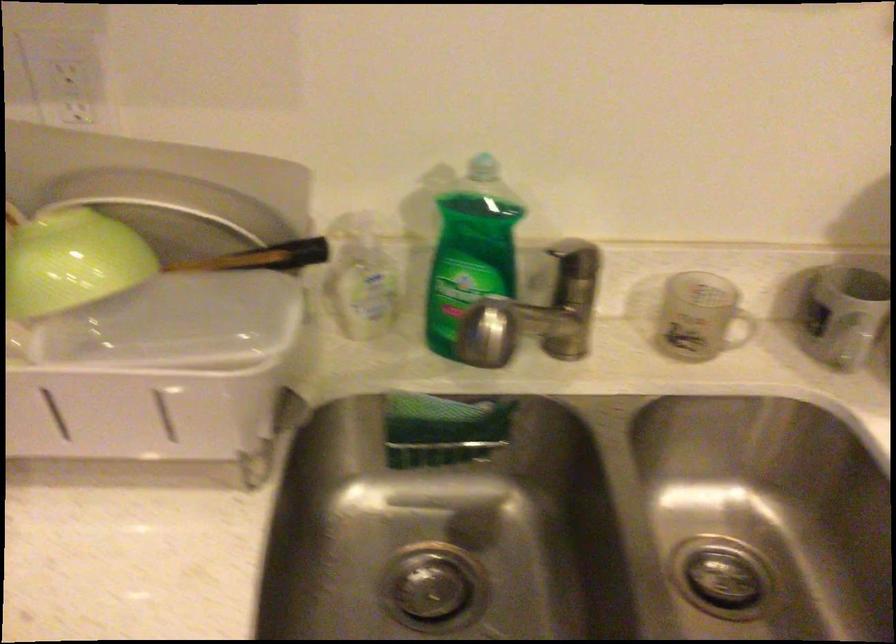
Where would you push the pump dispenser top? Please return your answer as a coordinate pair (x, y).

(487, 333)